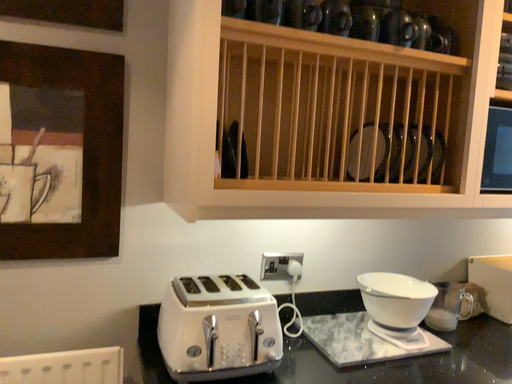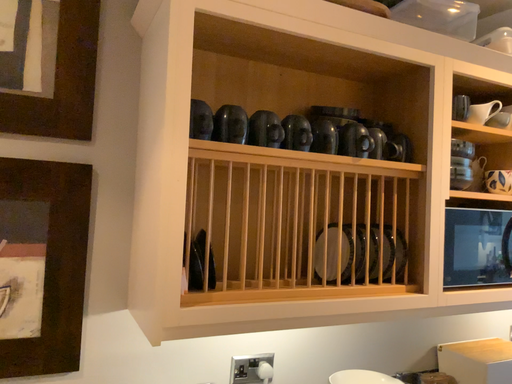
Question: Which way did the camera rotate in the video?

Choices:
 (A) rotated upward
 (B) rotated downward

Answer: (A)